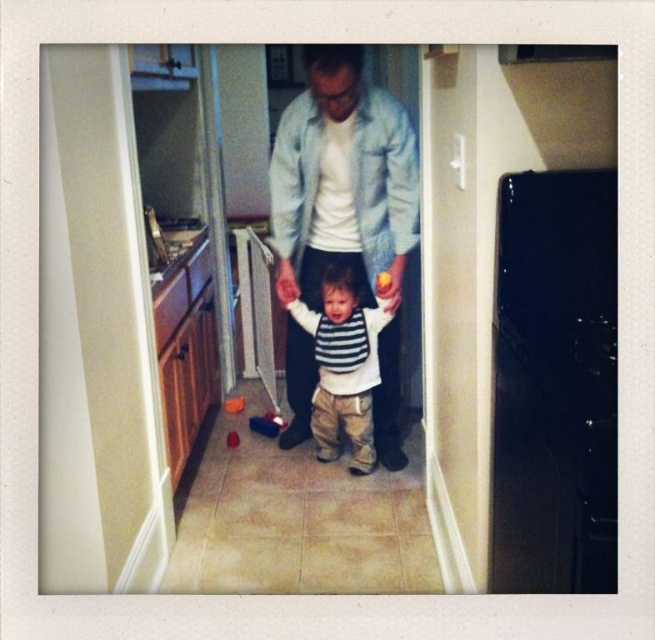
Question: Is denim jacket at center wider than striped cotton shirt at center?

Choices:
 (A) no
 (B) yes

Answer: (B)

Question: Which of the following is the farthest from the observer?

Choices:
 (A) striped cotton shirt at center
 (B) denim jacket at center

Answer: (A)

Question: In this image, where is denim jacket at center located relative to striped cotton shirt at center?

Choices:
 (A) right
 (B) left

Answer: (A)

Question: Which object appears closest to the camera in this image?

Choices:
 (A) striped cotton shirt at center
 (B) denim jacket at center

Answer: (B)

Question: Does denim jacket at center have a smaller size compared to striped cotton shirt at center?

Choices:
 (A) no
 (B) yes

Answer: (A)